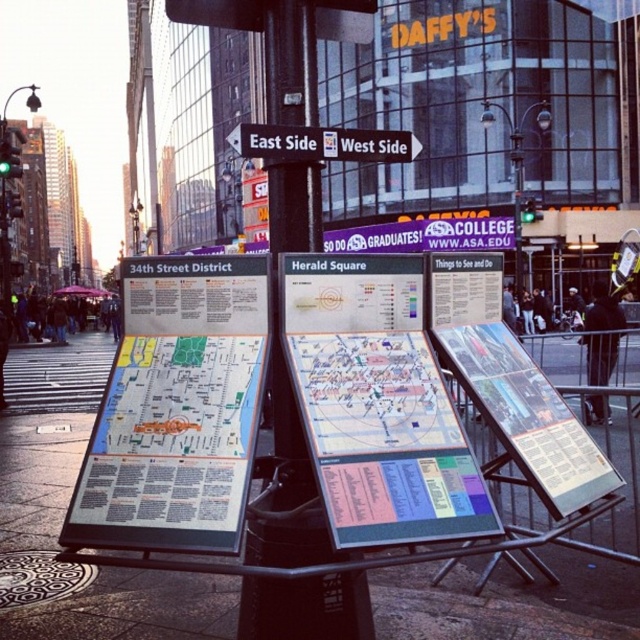
Question: From the image, what is the correct spatial relationship of smooth concrete pavement at center in relation to white plastic street sign at center?

Choices:
 (A) right
 (B) left

Answer: (B)

Question: Which of the following is the farthest from the observer?

Choices:
 (A) (371, 157)
 (B) (465, 218)

Answer: (B)

Question: Which object is closer to the camera taking this photo?

Choices:
 (A) white paper map at center
 (B) smooth concrete pavement at center
 (C) white plastic street sign at center
 (D) blue plastic sign at center

Answer: (A)

Question: In this image, where is white paper map at center located relative to blue plastic sign at center?

Choices:
 (A) above
 (B) below

Answer: (B)

Question: Can you confirm if smooth concrete pavement at center is bigger than white plastic street sign at center?

Choices:
 (A) yes
 (B) no

Answer: (A)

Question: Which point is farther from the camera taking this photo?

Choices:
 (A) (536, 550)
 (B) (230, 134)

Answer: (A)